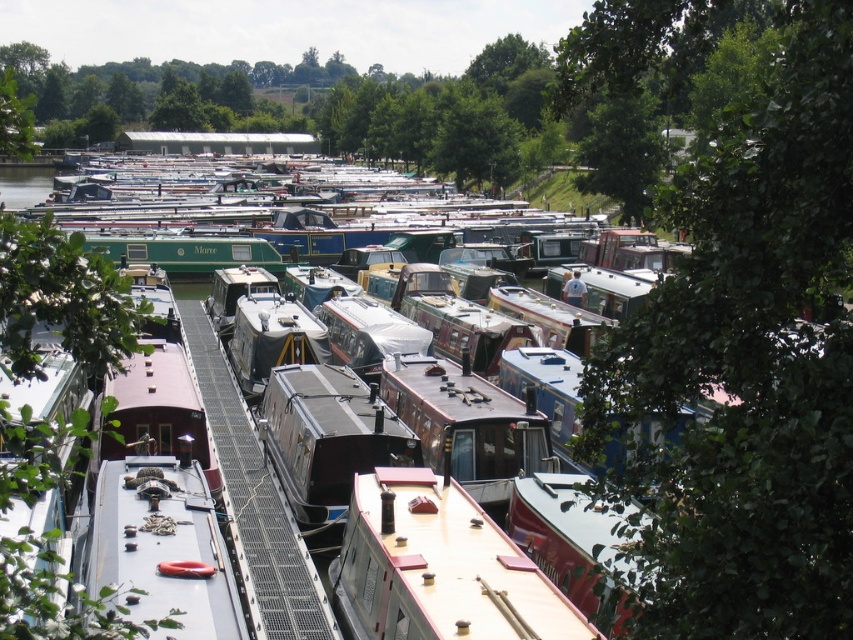
Between rustic wood boat at center and green leafy tree at upper left, which one is positioned higher?

Positioned higher is green leafy tree at upper left.

Where is `rustic wood boat at center`? Image resolution: width=853 pixels, height=640 pixels. rustic wood boat at center is located at coordinates (467, 424).

Looking at this image, measure the distance between rustic wood boat at center and camera.

rustic wood boat at center is 62.82 feet away from camera.

This screenshot has width=853, height=640. What are the coordinates of `rustic wood boat at center` in the screenshot? It's located at (467, 424).

Does green leafy tree at upper center have a larger size compared to green leafy tree at upper left?

Actually, green leafy tree at upper center might be smaller than green leafy tree at upper left.

In the scene shown: Between green leafy tree at upper center and green leafy tree at upper left, which one appears on the left side from the viewer's perspective?

green leafy tree at upper left is more to the left.

Which is behind, point (479, 172) or point (9, 109)?

Positioned behind is point (479, 172).

Where is `green leafy tree at upper center`? The height and width of the screenshot is (640, 853). green leafy tree at upper center is located at coordinates (476, 141).

Between metallic silver barge at center and white matte boat at center, which one has less height?

white matte boat at center is shorter.

Where is `metallic silver barge at center`? The width and height of the screenshot is (853, 640). metallic silver barge at center is located at coordinates (367, 250).

Who is more distant from viewer, (402,244) or (138,458)?

Positioned behind is point (402,244).

Where is `metallic silver barge at center`? metallic silver barge at center is located at coordinates (367, 250).